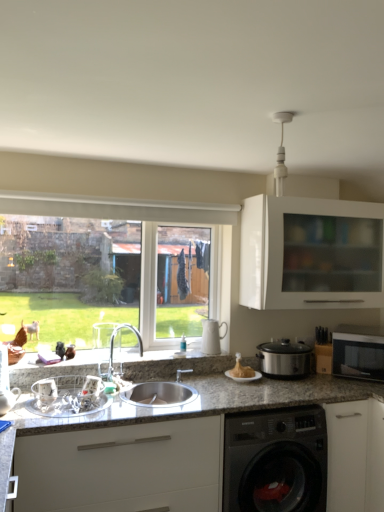
In order to click on vacant space underneath white ceramic teapot at center (from a real-world perspective) in this screenshot , I will do `click(220, 349)`.